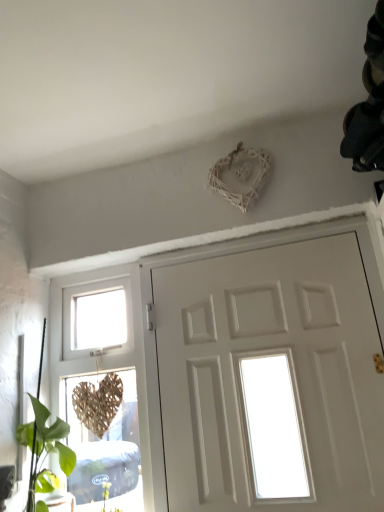
Question: From the image's perspective, is white matte door at center positioned above or below woven wood heart at left?

Choices:
 (A) above
 (B) below

Answer: (A)

Question: Is white matte door at center bigger or smaller than woven wood heart at left?

Choices:
 (A) small
 (B) big

Answer: (B)

Question: Considering their positions, is white matte door at center located in front of or behind woven wood heart at left?

Choices:
 (A) front
 (B) behind

Answer: (A)

Question: Considering the positions of point (110, 298) and point (297, 352), is point (110, 298) closer or farther from the camera than point (297, 352)?

Choices:
 (A) farther
 (B) closer

Answer: (A)

Question: In terms of height, does woven wood heart at left look taller or shorter compared to white matte door at center?

Choices:
 (A) tall
 (B) short

Answer: (A)

Question: Is woven wood heart at left to the left or to the right of white matte door at center in the image?

Choices:
 (A) left
 (B) right

Answer: (A)

Question: Is woven wood heart at left inside or outside of white matte door at center?

Choices:
 (A) inside
 (B) outside

Answer: (B)